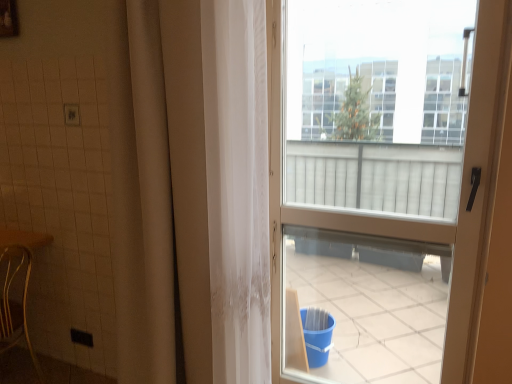
What is the approximate width of wooden chair at lower left?

17.63 inches.

Identify the location of wooden chair at lower left. (16, 304).

This screenshot has width=512, height=384. What do you see at coordinates (16, 304) in the screenshot?
I see `wooden chair at lower left` at bounding box center [16, 304].

What is the approximate height of matte plastic door at upper right?

It is 5.69 feet.

Measure the distance between point (511,29) and camera.

Point (511,29) and camera are 1.34 meters apart.

Where is `matte plastic door at upper right`? The height and width of the screenshot is (384, 512). matte plastic door at upper right is located at coordinates (387, 181).

This screenshot has width=512, height=384. Describe the element at coordinates (387, 181) in the screenshot. I see `matte plastic door at upper right` at that location.

I want to click on wooden chair at lower left, so 16,304.

Is wooden chair at lower left at the right side of matte plastic door at upper right?

No, wooden chair at lower left is not to the right of matte plastic door at upper right.

Which object is further away from the camera, wooden chair at lower left or matte plastic door at upper right?

Positioned behind is wooden chair at lower left.

Between point (4, 252) and point (414, 266), which one is positioned in front?

The point (4, 252) is closer to the camera.

Looking at this image, from the image's perspective, which one is positioned lower, wooden chair at lower left or matte plastic door at upper right?

From the image's view, wooden chair at lower left is below.

From a real-world perspective, is wooden chair at lower left positioned under matte plastic door at upper right based on gravity?

Yes.

Considering the sizes of objects wooden chair at lower left and matte plastic door at upper right in the image provided, who is thinner, wooden chair at lower left or matte plastic door at upper right?

matte plastic door at upper right.

Between wooden chair at lower left and matte plastic door at upper right, which one has less height?

wooden chair at lower left is shorter.

Does wooden chair at lower left have a larger size compared to matte plastic door at upper right?

Incorrect, wooden chair at lower left is not larger than matte plastic door at upper right.

Could matte plastic door at upper right be considered to be inside wooden chair at lower left?

No.

Is there a large distance between wooden chair at lower left and matte plastic door at upper right?

Yes.

Is wooden chair at lower left aimed at matte plastic door at upper right?

No, wooden chair at lower left does not turn towards matte plastic door at upper right.

This screenshot has width=512, height=384. I want to click on door located on the right of wooden chair at lower left, so click(x=387, y=181).

Between matte plastic door at upper right and wooden chair at lower left, which one appears on the left side from the viewer's perspective?

From the viewer's perspective, wooden chair at lower left appears more on the left side.

Which object is further away from the camera taking this photo, matte plastic door at upper right or wooden chair at lower left?

Positioned behind is wooden chair at lower left.

Does point (300, 380) come behind point (19, 244)?

Yes, point (300, 380) is farther from viewer.

From the image's perspective, between matte plastic door at upper right and wooden chair at lower left, which one is located above?

From the image's view, matte plastic door at upper right is above.

From a real-world perspective, between matte plastic door at upper right and wooden chair at lower left, who is vertically lower?

wooden chair at lower left, from a real-world perspective.

Which of these two, matte plastic door at upper right or wooden chair at lower left, is wider?

With larger width is wooden chair at lower left.

Is matte plastic door at upper right taller than wooden chair at lower left?

Yes.

Considering the sizes of objects matte plastic door at upper right and wooden chair at lower left in the image provided, who is bigger, matte plastic door at upper right or wooden chair at lower left?

matte plastic door at upper right.

Would you say matte plastic door at upper right is inside or outside wooden chair at lower left?

matte plastic door at upper right is not inside wooden chair at lower left, it's outside.

From the picture: Is matte plastic door at upper right placed right next to wooden chair at lower left?

No, matte plastic door at upper right is not making contact with wooden chair at lower left.

Does matte plastic door at upper right turn towards wooden chair at lower left?

No, matte plastic door at upper right is not facing towards wooden chair at lower left.

How different are the orientations of matte plastic door at upper right and wooden chair at lower left in degrees?

They differ by 94.6 degrees in their facing directions.

Where is `door above the wooden chair at lower left (from a real-world perspective)`? Image resolution: width=512 pixels, height=384 pixels. door above the wooden chair at lower left (from a real-world perspective) is located at coordinates (387, 181).

Where is `chair on the left of matte plastic door at upper right`? The height and width of the screenshot is (384, 512). chair on the left of matte plastic door at upper right is located at coordinates (16, 304).

Identify the location of door above the wooden chair at lower left (from the image's perspective). This screenshot has width=512, height=384. (387, 181).